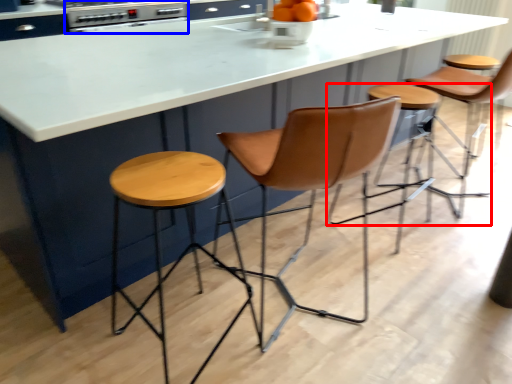
Question: Which point is further to the camera, stool (highlighted by a red box) or appliance (highlighted by a blue box)?

Choices:
 (A) stool
 (B) appliance

Answer: (B)